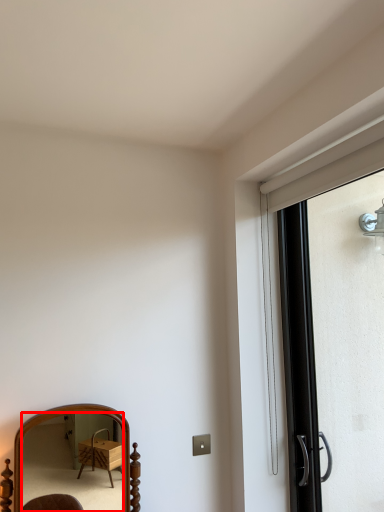
Question: Observing the image, what is the correct spatial positioning of mirror (annotated by the red box) in reference to screen door?

Choices:
 (A) left
 (B) right

Answer: (A)